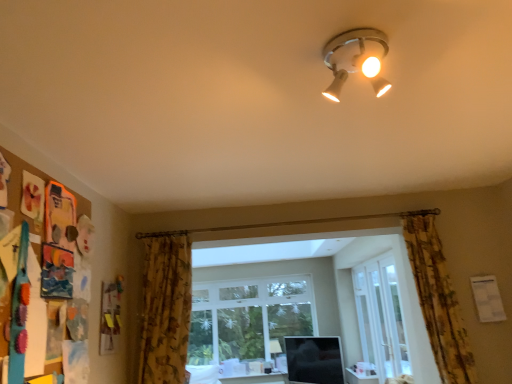
Question: Is matte white table at lower center to the left or to the right of matte white ceiling light at upper center, the first lamp viewed from the front, in the image?

Choices:
 (A) left
 (B) right

Answer: (A)

Question: Based on their sizes in the image, would you say matte white table at lower center is bigger or smaller than matte white ceiling light at upper center, the first lamp viewed from the front?

Choices:
 (A) small
 (B) big

Answer: (B)

Question: Which object is the farthest from the clear glass door at center?

Choices:
 (A) matte white lamp at lower center, the second lamp viewed from the front
 (B) floral fabric curtain at lower left, which is the 1th curtain in left-to-right order
 (C) clear glass window at center
 (D) floral fabric curtain at right, arranged as the 1th curtain when viewed from the right
 (E) white glossy screen door at center

Answer: (B)

Question: Based on their relative distances, which object is nearer to the clear glass window at center?

Choices:
 (A) white glossy screen door at center
 (B) floral fabric curtain at lower left, which appears as the second curtain when viewed from the right
 (C) matte white lamp at lower center, the second lamp viewed from the front
 (D) floral fabric curtain at right, arranged as the 1th curtain when viewed from the right
 (E) matte white ceiling light at upper center, which ranks as the 1th lamp in top-to-bottom order

Answer: (C)